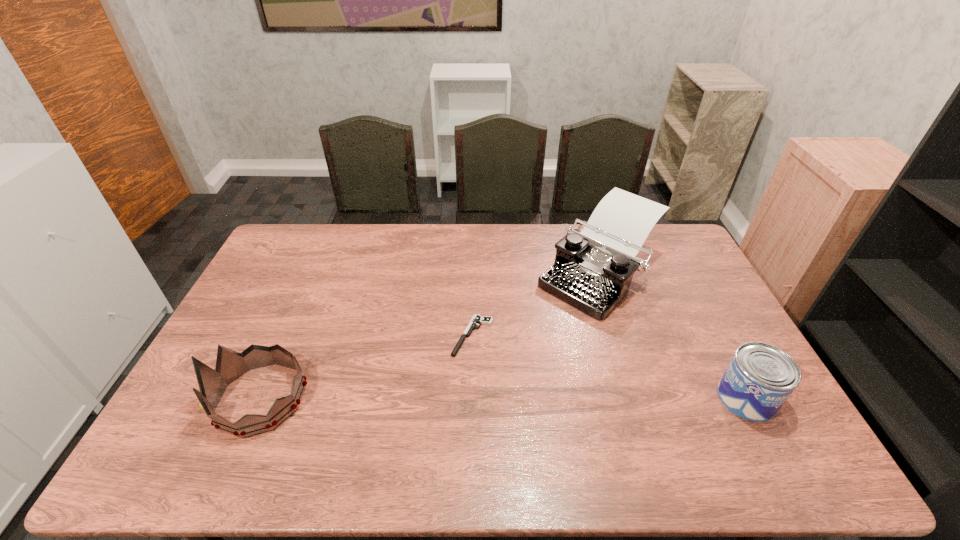
The image size is (960, 540). In order to click on empty space between the shortest object and the tallest object in this screenshot , I will do `click(536, 305)`.

Identify the location of vacant area between the can and the leftmost object. This screenshot has height=540, width=960. (503, 398).

Identify the location of free point between the tallest object and the second object from left to right. Image resolution: width=960 pixels, height=540 pixels. (536, 305).

At what (x,y) coordinates should I click in order to perform the action: click on unoccupied position between the second shortest object and the second object from left to right. Please return your answer as a coordinate pair (x, y). The width and height of the screenshot is (960, 540). Looking at the image, I should click on (610, 367).

Where is `vacant point located between the tiara and the can`? The image size is (960, 540). vacant point located between the tiara and the can is located at coordinates (503, 398).

Where is `vacant space that's between the typewriter and the tiara`? The height and width of the screenshot is (540, 960). vacant space that's between the typewriter and the tiara is located at coordinates (430, 335).

Locate an element on the screen. This screenshot has height=540, width=960. the closest object relative to the tallest object is located at coordinates (476, 319).

Where is `object that stands as the second closest to the third tallest object`? The image size is (960, 540). object that stands as the second closest to the third tallest object is located at coordinates (476, 319).